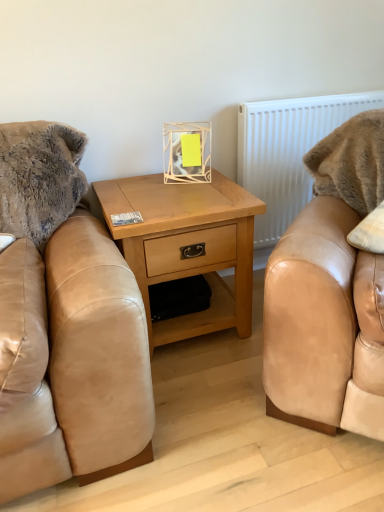
Locate an element on the screen. The width and height of the screenshot is (384, 512). free space in front of light wood/texture nightstand at center is located at coordinates (212, 402).